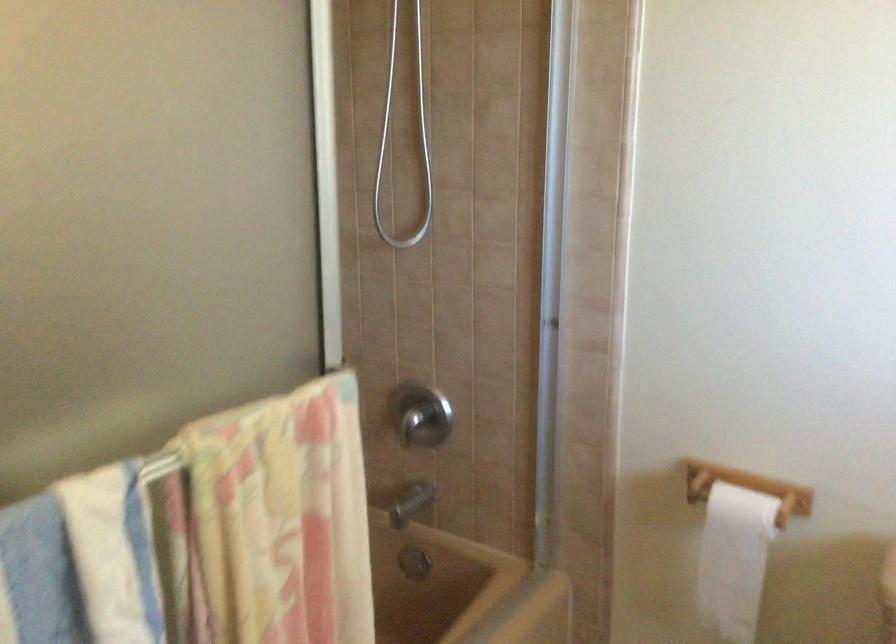
The first image is from the beginning of the video and the second image is from the end. How did the camera likely rotate when shooting the video?

The camera rotated toward left-down.